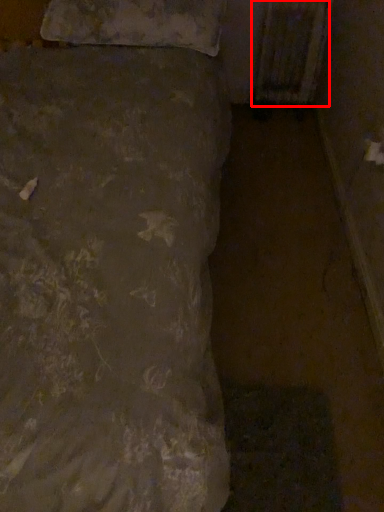
Question: In this image, where is radiator (annotated by the red box) located relative to pillow?

Choices:
 (A) left
 (B) right

Answer: (B)